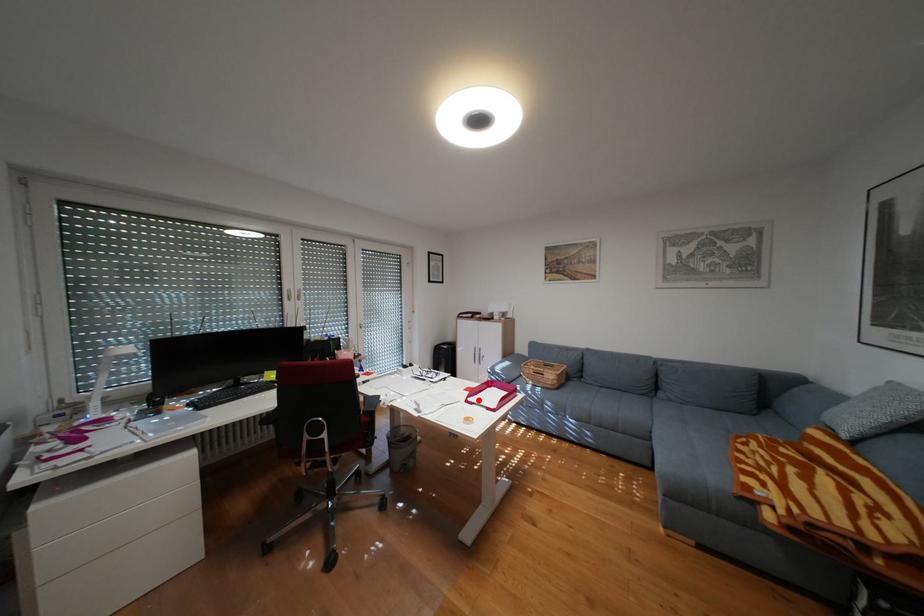
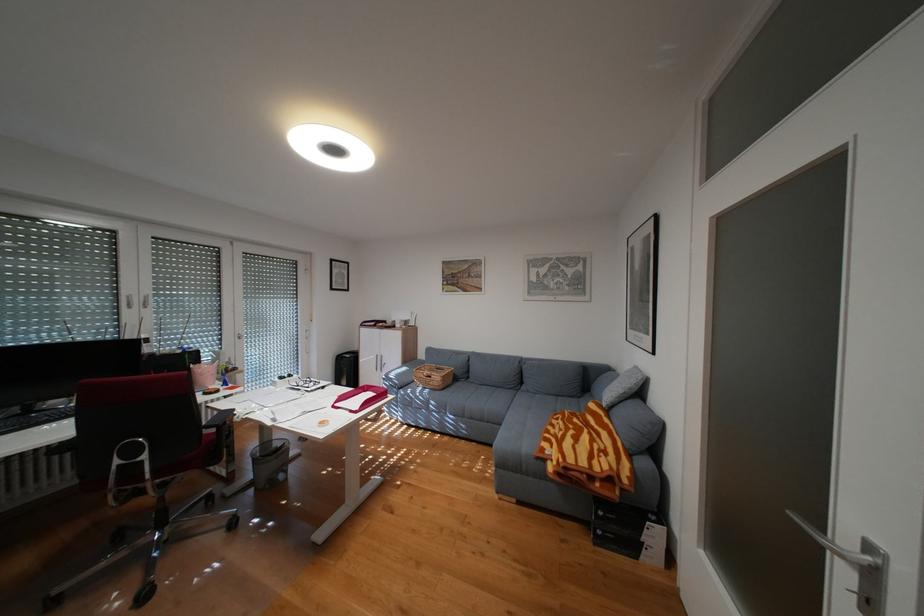
Question: I am providing you with two images of the same scene from different viewpoints. A red point is shown in image1. For the corresponding object point in image2, is it positioned nearer or farther from the camera?

Choices:
 (A) Nearer
 (B) Farther

Answer: (A)